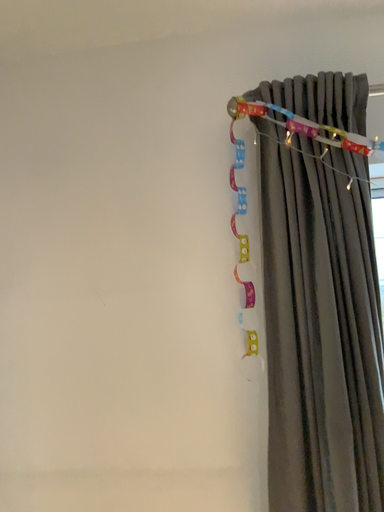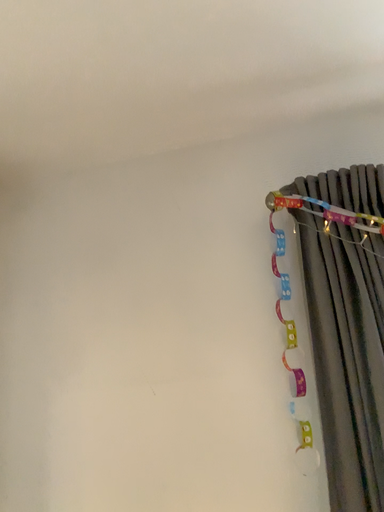
Question: How did the camera likely rotate when shooting the video?

Choices:
 (A) rotated upward
 (B) rotated downward

Answer: (A)